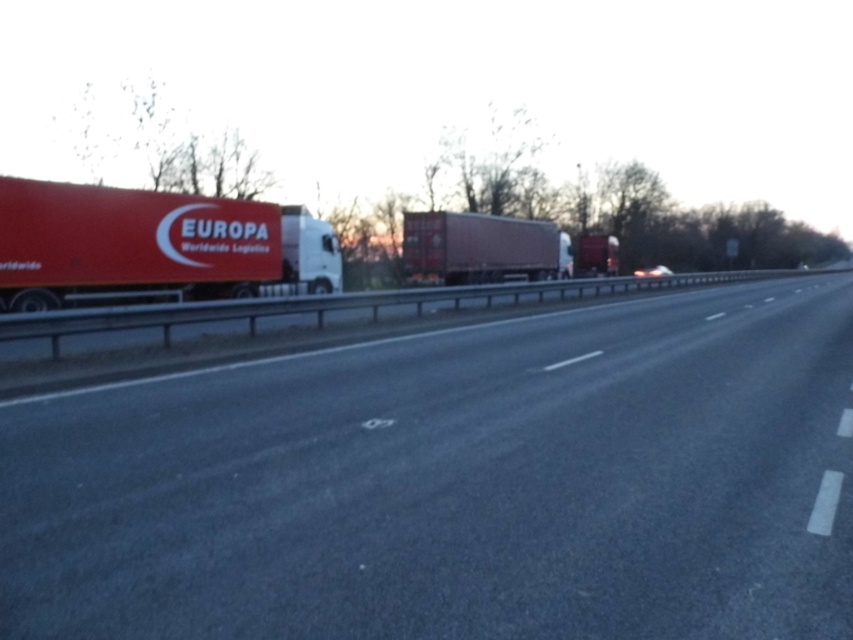
You are a delivery driver who needs to pass the matte red trailer truck at center on the smooth asphalt highway at center. The minimum safe passing distance required by law is 90 feet. Can you safely pass the truck?

The smooth asphalt highway at center and matte red trailer truck at center are 92.42 feet apart, which exceeds the minimum safe passing distance of 90 feet. Therefore, you can safely pass the matte red trailer truck at center on the smooth asphalt highway at center.

From the picture: You are a delivery driver who needs to park your truck at the designated spot marked by point (151, 244). However, there is an object at that location. What is the object blocking the parking spot?

The object at point (151, 244) is a matte red truck at left, which is blocking the parking spot.

You are a delivery driver who needs to park your truck on the smooth asphalt highway at center. However, there is a matte red truck at left already parked there. Can you park your truck behind the existing one without overlapping?

The smooth asphalt highway at center is not as tall as the matte red truck at left, so parking behind it might block visibility due to the truck being taller than the road surface. However, since highways are designed for vehicles to pass each other, you should instead look for designated parking areas or pull over to the side.